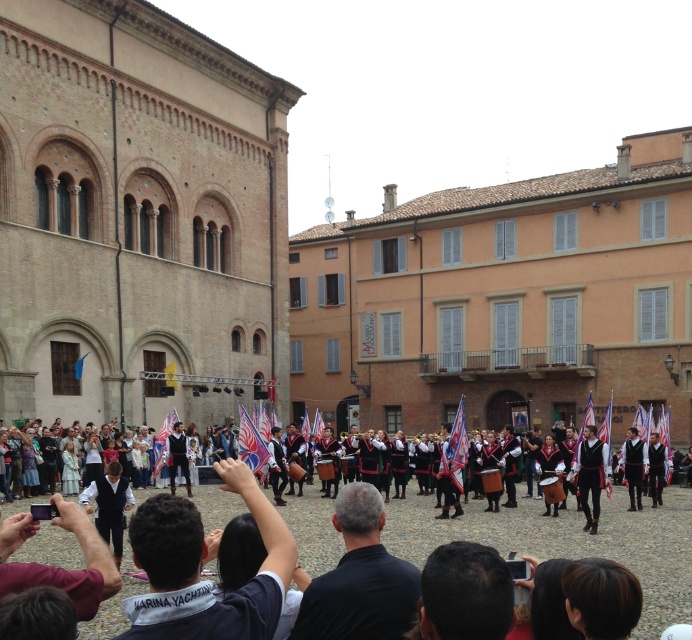
Question: Which object is positioned farthest from the maroon fabric shirt at lower left?

Choices:
 (A) brick wall at center
 (B) dark blue fabric at center
 (C) orange brick building at center
 (D) dark brown hair at center

Answer: (C)

Question: Is brick wall at center to the left of dark blue shirt at center from the viewer's perspective?

Choices:
 (A) no
 (B) yes

Answer: (B)

Question: Is dark blue shirt at center to the right of dark blue fabric at center from the viewer's perspective?

Choices:
 (A) no
 (B) yes

Answer: (A)

Question: Can you confirm if dark brown hair at center is wider than dark blue fabric at center?

Choices:
 (A) yes
 (B) no

Answer: (B)

Question: Which of the following is the farthest from the observer?

Choices:
 (A) (304, 385)
 (B) (89, 557)

Answer: (A)

Question: Which of the following is the closest to the observer?

Choices:
 (A) maroon fabric shirt at lower left
 (B) brick wall at center
 (C) black cotton shirt at center
 (D) orange brick building at center

Answer: (A)